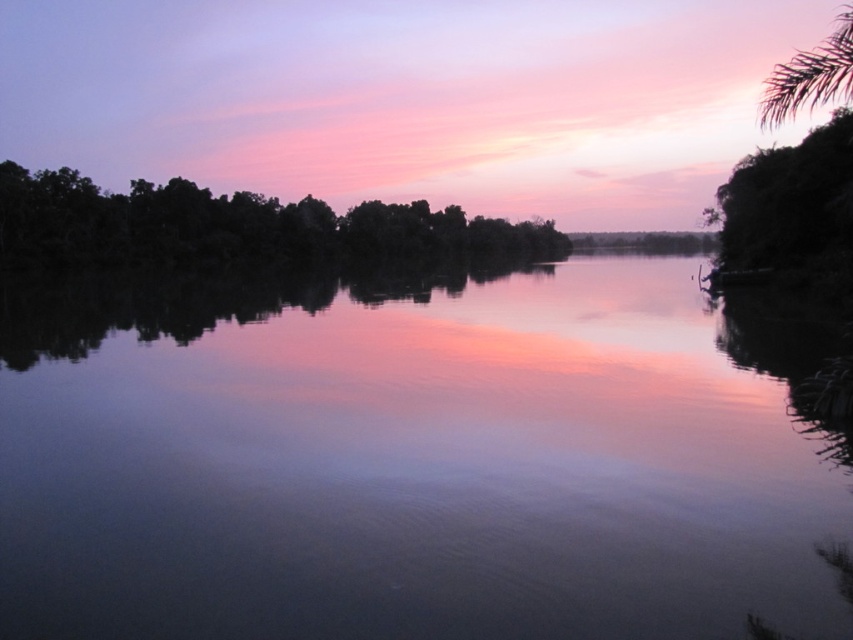
Is smooth water at center above green leafy tree at upper right?

No.

This screenshot has width=853, height=640. What are the coordinates of `smooth water at center` in the screenshot? It's located at (405, 461).

I want to click on smooth water at center, so click(405, 461).

Does smooth water at center lie in front of dark green leafy trees at left?

Yes, smooth water at center is in front of dark green leafy trees at left.

Which is behind, point (798, 483) or point (387, 205)?

The point (387, 205) is more distant.

Where is `smooth water at center`? The width and height of the screenshot is (853, 640). smooth water at center is located at coordinates (405, 461).

Does dark green leafy trees at left come in front of green leafy tree at upper right?

That is False.

Who is more forward, (x=108, y=193) or (x=822, y=83)?

Point (x=822, y=83) is more forward.

Where is `dark green leafy trees at left`? Image resolution: width=853 pixels, height=640 pixels. dark green leafy trees at left is located at coordinates (230, 225).